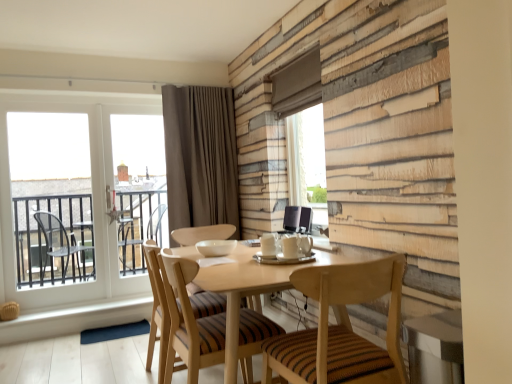
Question: Is white glass window at left situated inside transparent glass window screen at upper center, the 1th window screen from the right, or outside?

Choices:
 (A) inside
 (B) outside

Answer: (B)

Question: Relative to transparent glass window screen at upper center, the 2th window screen viewed from the back, is white glass window at left in front or behind?

Choices:
 (A) front
 (B) behind

Answer: (B)

Question: Considering the real-world distances, which object is farthest from the white glass window at left?

Choices:
 (A) transparent glass door at left, which is the second window screen from front to back
 (B) brown velvet curtain at upper center
 (C) light wood textured chair at center, arranged as the first chair when viewed from the left
 (D) wooden striped chair at center, the second chair viewed from the left
 (E) transparent glass window screen at upper center, the 1th window screen from the right

Answer: (D)

Question: Which of these objects is positioned farthest from the white glass window at left?

Choices:
 (A) wooden striped chair at center, acting as the 1th chair starting from the right
 (B) brown velvet curtain at upper center
 (C) transparent glass window screen at upper center, the 2th window screen viewed from the back
 (D) light wood textured chair at center, which is the 2th chair from right to left
 (E) transparent glass door at left, which is the first window screen in left-to-right order

Answer: (A)